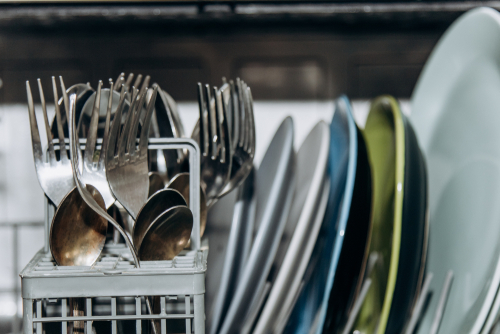
The image size is (500, 334). I want to click on white plates, so click(496, 326), click(488, 307), click(318, 234), click(305, 220), click(269, 190).